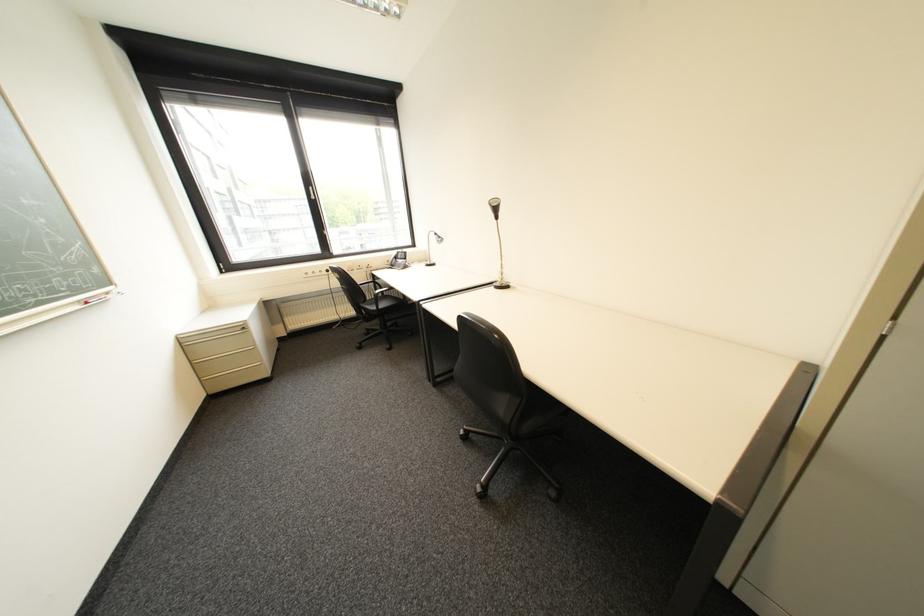
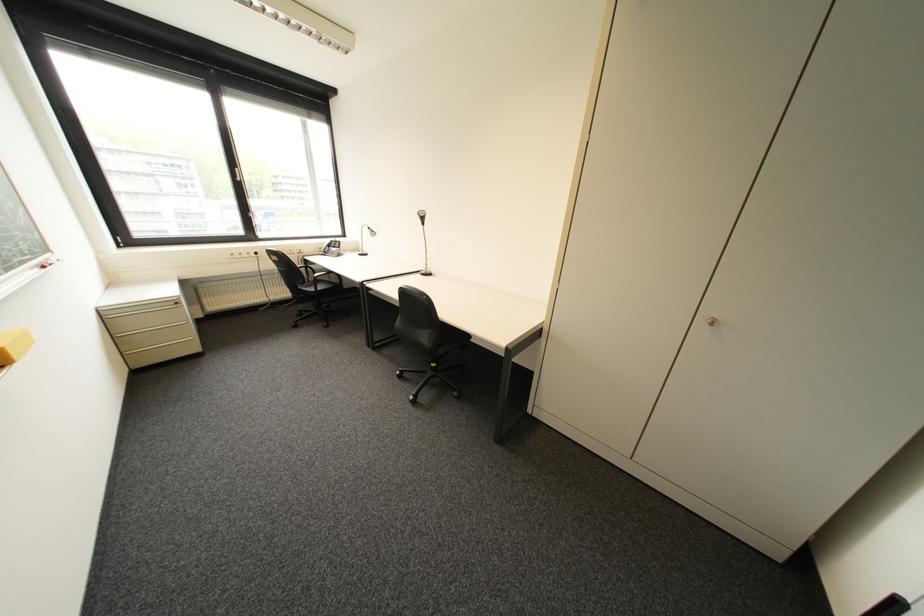
In the second image, find the point that corresponds to point 431,262 in the first image.

(362, 252)